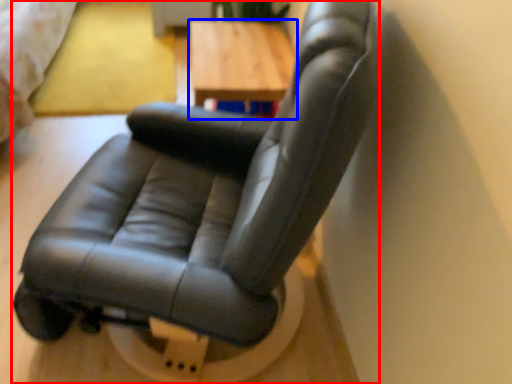
Question: Which object is further to the camera taking this photo, chair (highlighted by a red box) or table (highlighted by a blue box)?

Choices:
 (A) chair
 (B) table

Answer: (B)